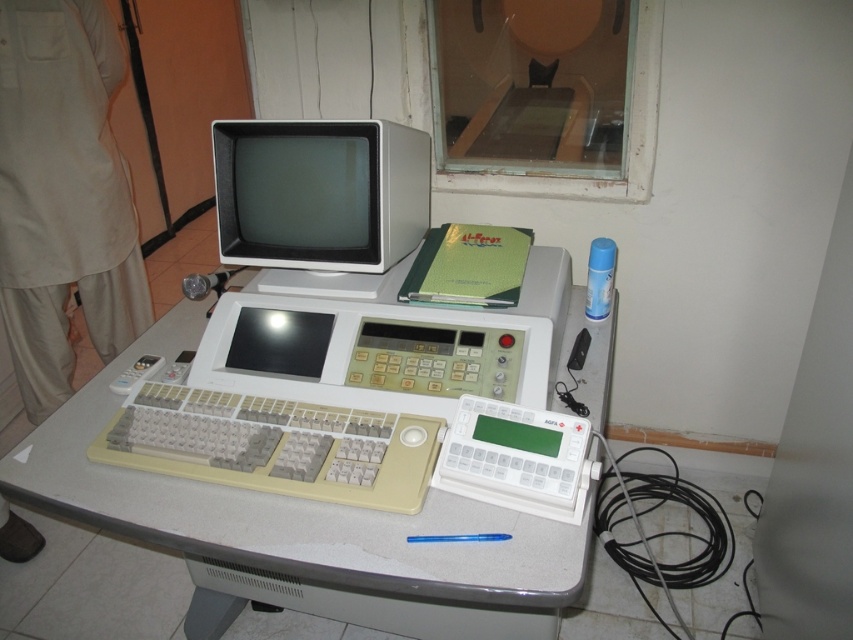
Question: Does white plastic table at center have a greater width compared to beige plastic keyboard at center?

Choices:
 (A) yes
 (B) no

Answer: (A)

Question: Can you confirm if white plastic table at center is smaller than beige plastic keyboard at center?

Choices:
 (A) yes
 (B) no

Answer: (B)

Question: Which object appears farthest from the camera in this image?

Choices:
 (A) white plastic table at center
 (B) matte white monitor at center
 (C) beige plastic keyboard at center

Answer: (B)

Question: Where is matte white monitor at center located in relation to beige plastic keyboard at center in the image?

Choices:
 (A) above
 (B) below

Answer: (A)

Question: Which point appears closest to the camera in this image?

Choices:
 (A) (244, 572)
 (B) (372, 180)

Answer: (B)

Question: Which of these objects is positioned closest to the white plastic table at center?

Choices:
 (A) matte white monitor at center
 (B) beige plastic keyboard at center

Answer: (B)